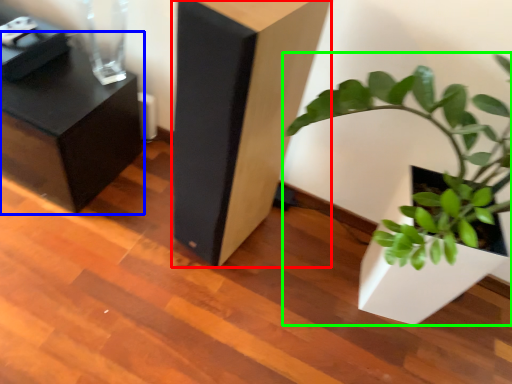
Question: Which object is the farthest from furniture (highlighted by a red box)? Choose among these: furniture (highlighted by a blue box) or houseplant (highlighted by a green box).

Choices:
 (A) furniture
 (B) houseplant

Answer: (A)